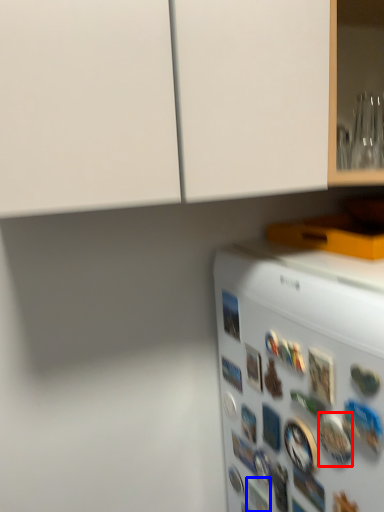
Question: Among these objects, which one is nearest to the camera, button (highlighted by a red box) or button (highlighted by a blue box)?

Choices:
 (A) button
 (B) button

Answer: (A)